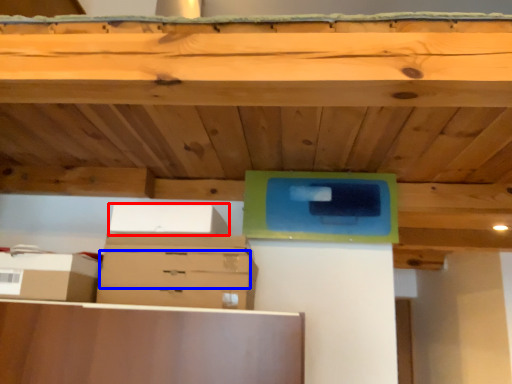
Question: Which object is further to the camera taking this photo, storage box (highlighted by a red box) or drawer (highlighted by a blue box)?

Choices:
 (A) storage box
 (B) drawer

Answer: (B)